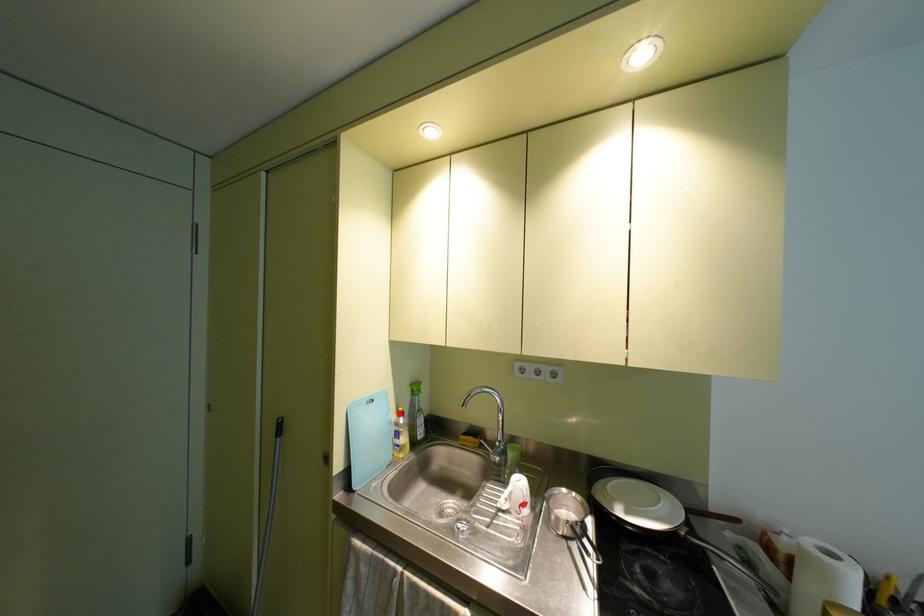
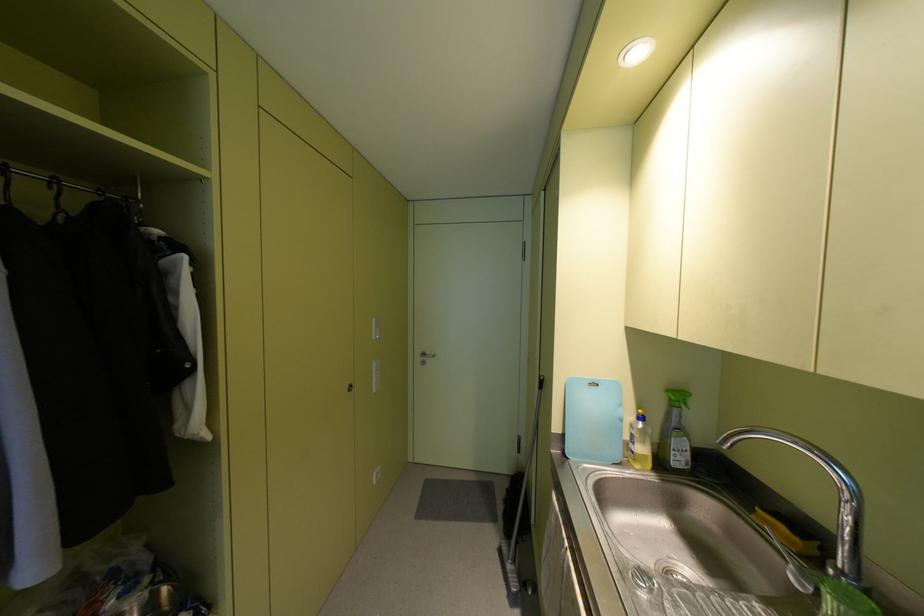
Locate, in the second image, the point that corresponds to the highlighted location in the first image.

(640, 416)